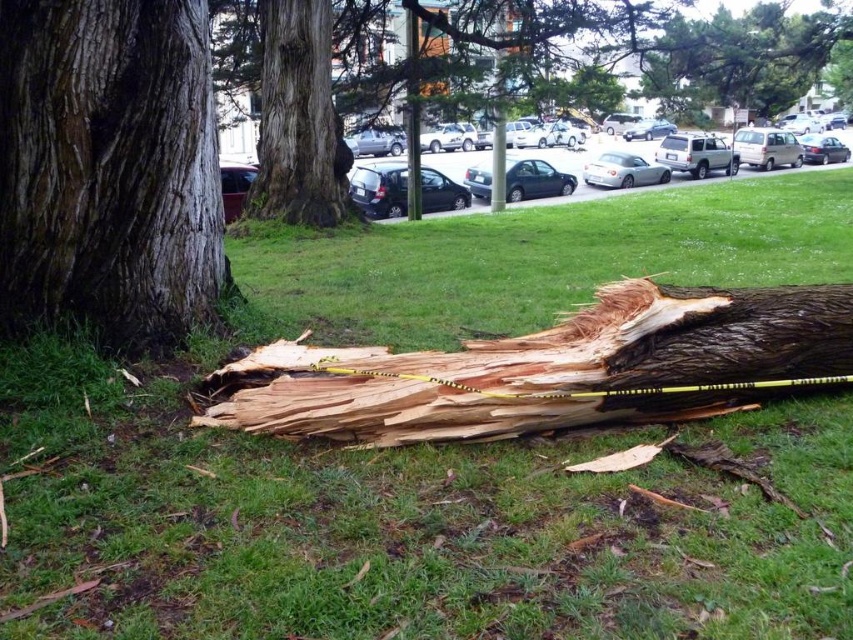
You are a safety inspector standing at the edge of the parking lot. You see the dark brown rough bark at center in the image. Can you safely walk up to it without crossing the caution tape?

The dark brown rough bark at center is 6.35 feet away from the camera. Since the caution tape is stretched across the fallen tree, you should not cross it. Therefore, you cannot safely walk up to the dark brown rough bark at center without crossing the caution tape.

You are a park maintenance worker who needs to mow the lawn. You see the green grass at lower center and the dark brown rough bark at center. Which area should you avoid mowing to prevent damaging equipment?

You should avoid mowing the dark brown rough bark at center because it is taller than the green grass at lower center, and mowing over rough bark could damage the equipment.